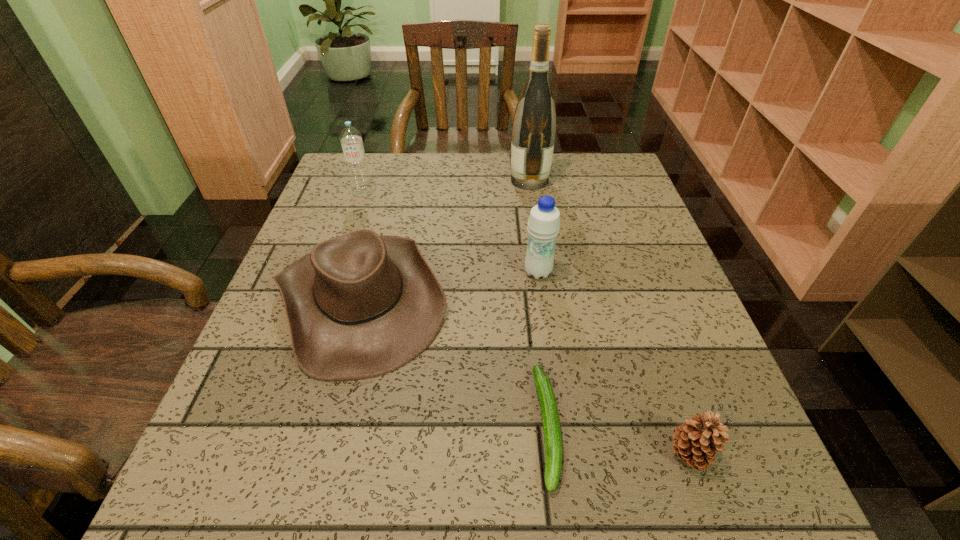
Locate an element on the screen. wine bottle is located at coordinates (534, 125).

Where is `the farther water bottle`? The image size is (960, 540). the farther water bottle is located at coordinates (351, 138).

Where is `the right water bottle`? This screenshot has height=540, width=960. the right water bottle is located at coordinates (544, 220).

You are a GUI agent. You are given a task and a screenshot of the screen. Output one action in this format:
    pyautogui.click(x=<x>, y=<y>)
    Task: Click on the third shortest object
    This screenshot has height=540, width=960.
    Given the screenshot: What is the action you would take?
    pyautogui.click(x=360, y=305)

Image resolution: width=960 pixels, height=540 pixels. I want to click on pinecone, so click(x=696, y=442).

Image resolution: width=960 pixels, height=540 pixels. I want to click on the rightmost object, so click(696, 442).

You are a GUI agent. You are given a task and a screenshot of the screen. Output one action in this format:
    pyautogui.click(x=<x>, y=<y>)
    Task: Click on the shortest object
    The image size is (960, 540).
    Given the screenshot: What is the action you would take?
    pyautogui.click(x=550, y=417)

Identify the location of vacant space located on the label of the tallest object. (462, 180).

In order to click on free space located 0.050m on the label of the tallest object in this screenshot , I will do `click(492, 180)`.

The height and width of the screenshot is (540, 960). In order to click on free space located on the label of the tallest object in this screenshot , I will do `click(374, 180)`.